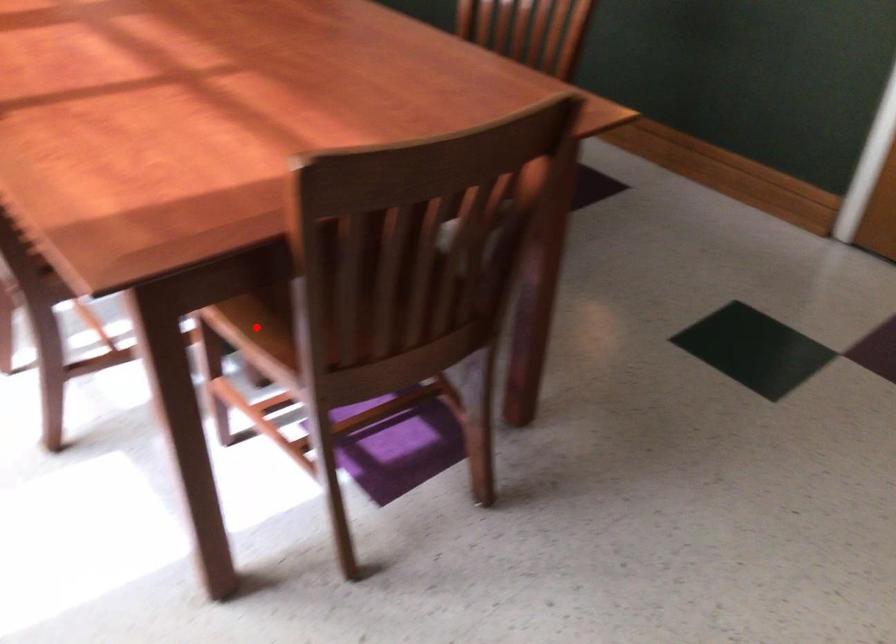
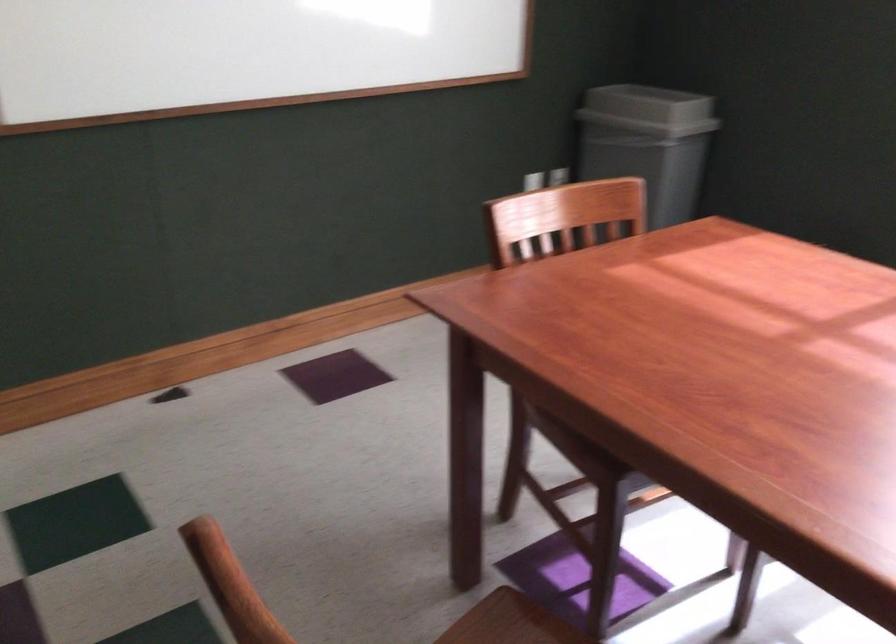
Question: I am providing you with two images of the same scene from different viewpoints. A red point is marked on the first image. Can you still see the location of the red point in image 2?

Choices:
 (A) Yes
 (B) No

Answer: (B)